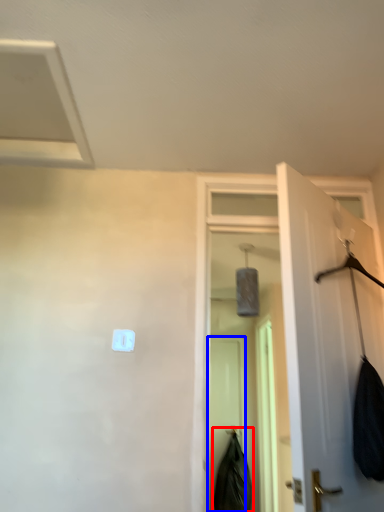
Question: Among these objects, which one is nearest to the camera, clothing (highlighted by a red box) or screen door (highlighted by a blue box)?

Choices:
 (A) clothing
 (B) screen door

Answer: (A)